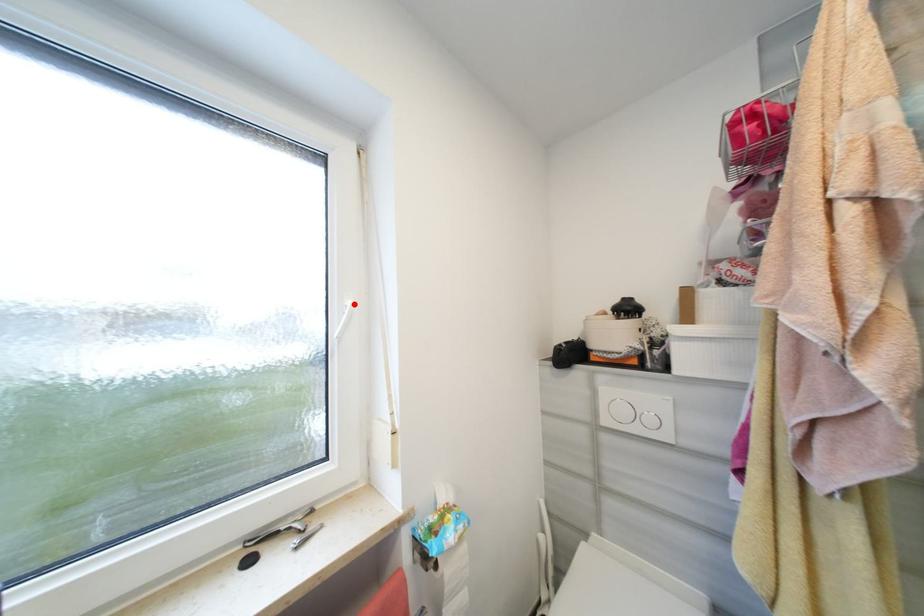
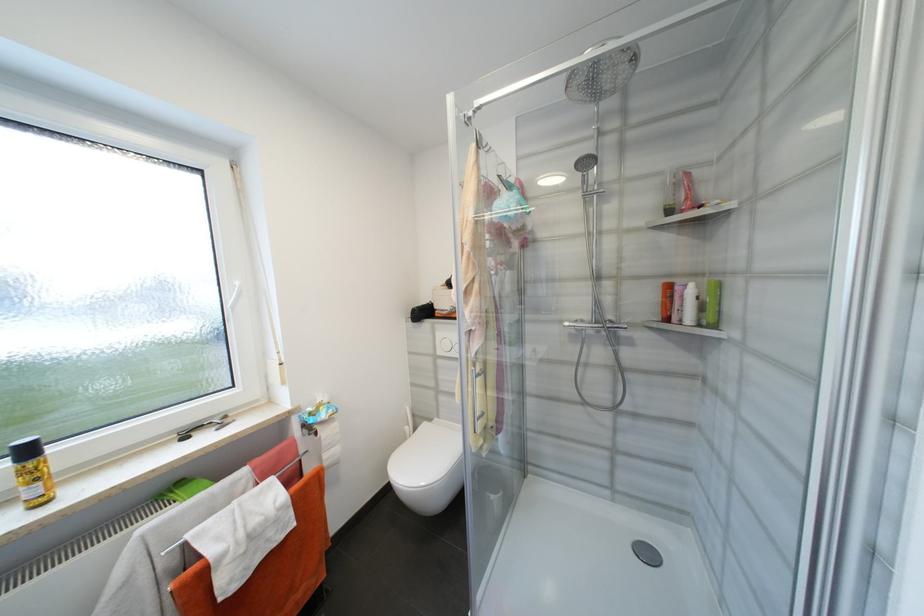
Find the pixel in the second image that matches the highlighted location in the first image.

(242, 285)